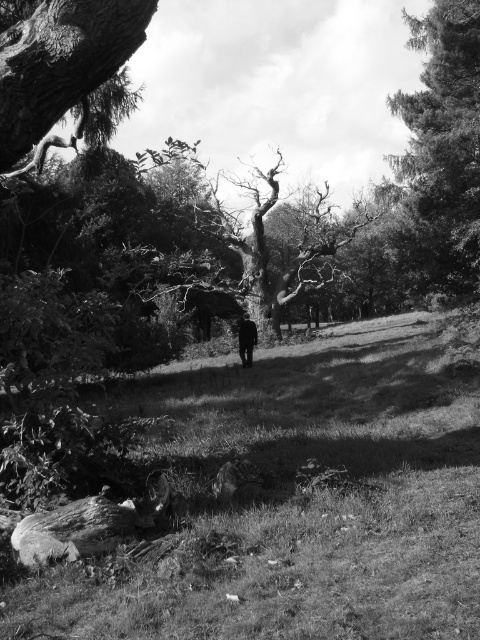
Question: Which object is farther from the camera taking this photo?

Choices:
 (A) grassy field at lower left
 (B) smooth green tree at upper right

Answer: (B)

Question: Can you confirm if grassy field at lower left is bigger than dark textured bark at upper left?

Choices:
 (A) yes
 (B) no

Answer: (A)

Question: Does grassy field at lower left appear under smooth green tree at upper right?

Choices:
 (A) yes
 (B) no

Answer: (A)

Question: Which object appears farthest from the camera in this image?

Choices:
 (A) grassy field at lower left
 (B) smooth green tree at upper right
 (C) dark textured bark at upper left

Answer: (B)

Question: Is grassy field at lower left to the left of smooth green tree at upper right from the viewer's perspective?

Choices:
 (A) yes
 (B) no

Answer: (A)

Question: Which of the following is the closest to the observer?

Choices:
 (A) dark textured bark at upper left
 (B) smooth green tree at upper right
 (C) grassy field at lower left

Answer: (C)